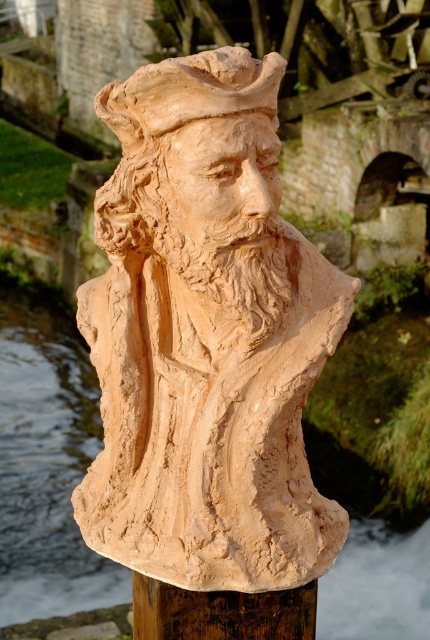
Does matte clay bust at center appear over terracotta sculpture at center?

Actually, matte clay bust at center is below terracotta sculpture at center.

Between point (30, 316) and point (166, 112), which one is positioned behind?

Point (30, 316)

Is point (48, 419) closer to camera compared to point (264, 83)?

No, it is not.

I want to click on matte clay bust at center, so click(46, 465).

Is terracotta sculpture at center below brown wood post at center?

Actually, terracotta sculpture at center is above brown wood post at center.

Which is below, terracotta sculpture at center or brown wood post at center?

brown wood post at center is lower down.

I want to click on terracotta sculpture at center, so click(187, 93).

Is matte clay bust at center positioned at the back of brown wood post at center?

Yes, matte clay bust at center is further from the viewer.

Can you confirm if matte clay bust at center is wider than brown wood post at center?

Correct, the width of matte clay bust at center exceeds that of brown wood post at center.

Describe the element at coordinates (46, 465) in the screenshot. I see `matte clay bust at center` at that location.

What are the coordinates of `matte clay bust at center` in the screenshot? It's located at (46, 465).